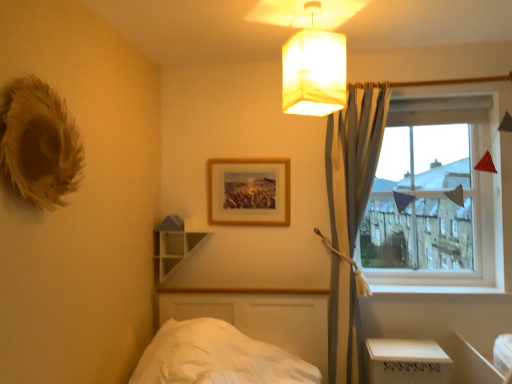
Question: Does clear glass window at right have a larger size compared to light gray fabric curtain at upper right?

Choices:
 (A) no
 (B) yes

Answer: (A)

Question: Considering the relative sizes of clear glass window at right and light gray fabric curtain at upper right in the image provided, is clear glass window at right wider than light gray fabric curtain at upper right?

Choices:
 (A) yes
 (B) no

Answer: (B)

Question: Is clear glass window at right positioned beyond the bounds of light gray fabric curtain at upper right?

Choices:
 (A) yes
 (B) no

Answer: (A)

Question: Is clear glass window at right positioned with its back to light gray fabric curtain at upper right?

Choices:
 (A) yes
 (B) no

Answer: (B)

Question: Does clear glass window at right contain light gray fabric curtain at upper right?

Choices:
 (A) yes
 (B) no

Answer: (B)

Question: Considering the relative sizes of clear glass window at right and light gray fabric curtain at upper right in the image provided, is clear glass window at right smaller than light gray fabric curtain at upper right?

Choices:
 (A) yes
 (B) no

Answer: (A)

Question: Is wooden picture frame at upper center in contact with light gray fabric curtain at upper right?

Choices:
 (A) yes
 (B) no

Answer: (B)

Question: Is wooden picture frame at upper center shorter than light gray fabric curtain at upper right?

Choices:
 (A) no
 (B) yes

Answer: (B)

Question: From the image's perspective, is wooden picture frame at upper center over light gray fabric curtain at upper right?

Choices:
 (A) no
 (B) yes

Answer: (B)

Question: From a real-world perspective, is wooden picture frame at upper center on light gray fabric curtain at upper right?

Choices:
 (A) no
 (B) yes

Answer: (B)

Question: Can you confirm if wooden picture frame at upper center is wider than light gray fabric curtain at upper right?

Choices:
 (A) no
 (B) yes

Answer: (A)

Question: Does wooden picture frame at upper center have a smaller size compared to light gray fabric curtain at upper right?

Choices:
 (A) no
 (B) yes

Answer: (B)

Question: From a real-world perspective, is green matte shelf at upper center positioned under clear glass window at right based on gravity?

Choices:
 (A) no
 (B) yes

Answer: (B)